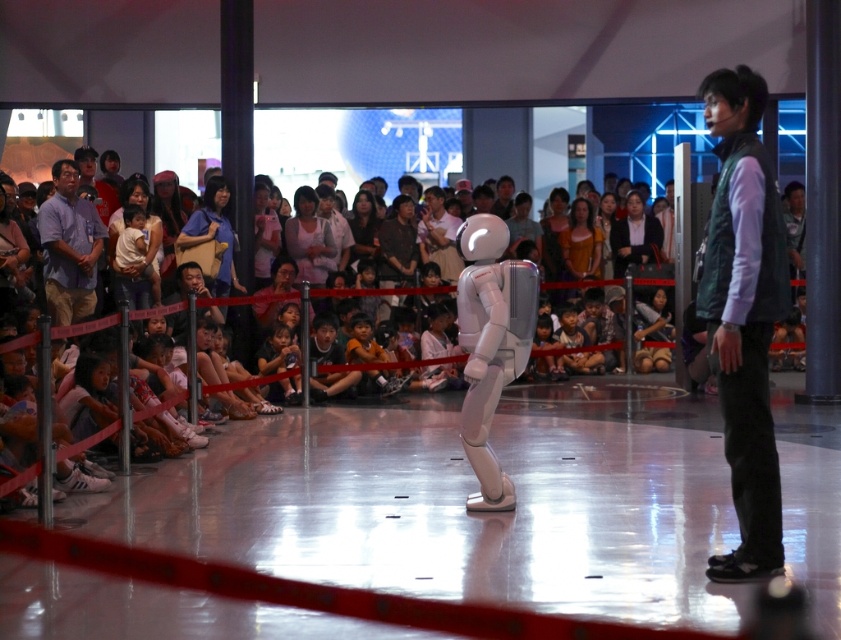
Question: Considering the real-world distances, which object is closest to the light pink fabric at center?

Choices:
 (A) dark green vest at right
 (B) light blue shirt at left

Answer: (B)

Question: Can you confirm if dark green vest at right is bigger than matte black hair at center?

Choices:
 (A) yes
 (B) no

Answer: (A)

Question: Estimate the real-world distances between objects in this image. Which object is farther from the dark green vest at right?

Choices:
 (A) matte black hair at center
 (B) dark gray suit at center

Answer: (B)

Question: Does light blue shirt at left come behind matte black bag at center?

Choices:
 (A) yes
 (B) no

Answer: (B)

Question: Which of these objects is positioned farthest from the light blue shirt at left?

Choices:
 (A) dark gray suit at center
 (B) light pink fabric at center

Answer: (A)

Question: From the image, what is the correct spatial relationship of light blue shirt at left in relation to matte black bag at center?

Choices:
 (A) above
 (B) below

Answer: (B)